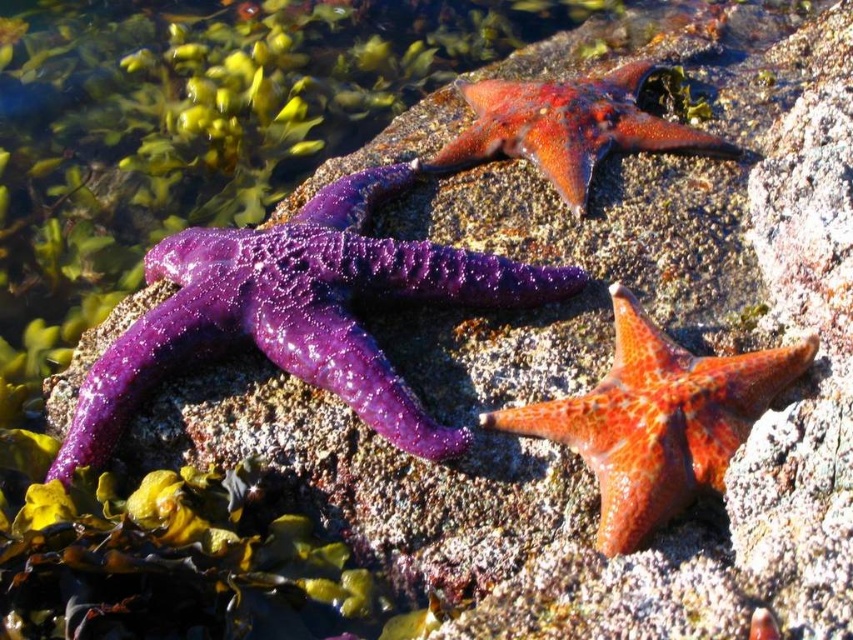
Question: Among these points, which one is nearest to the camera?

Choices:
 (A) (515, 96)
 (B) (271, 285)
 (C) (698, 432)

Answer: (C)

Question: In this image, where is purple wet starfish at left located relative to shiny orange starfish at center?

Choices:
 (A) below
 (B) above

Answer: (B)

Question: Estimate the real-world distances between objects in this image. Which object is farther from the purple wet starfish at left?

Choices:
 (A) shiny orange starfish at center
 (B) shiny orange starfish at upper center

Answer: (B)

Question: Estimate the real-world distances between objects in this image. Which object is closer to the purple wet starfish at left?

Choices:
 (A) shiny orange starfish at center
 (B) shiny orange starfish at upper center

Answer: (A)

Question: Is purple wet starfish at left further to camera compared to shiny orange starfish at upper center?

Choices:
 (A) yes
 (B) no

Answer: (B)

Question: Considering the relative positions of purple wet starfish at left and shiny orange starfish at upper center in the image provided, where is purple wet starfish at left located with respect to shiny orange starfish at upper center?

Choices:
 (A) right
 (B) left

Answer: (B)